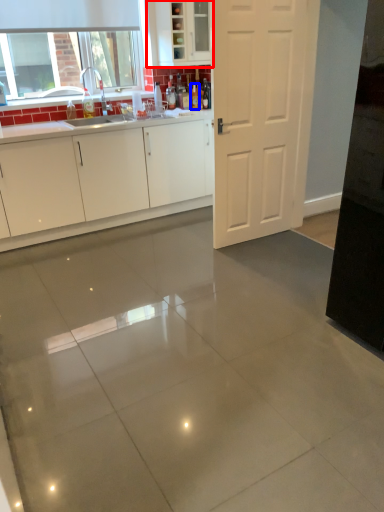
Question: Which object appears farthest to the camera in this image, cabinetry (highlighted by a red box) or bottle (highlighted by a blue box)?

Choices:
 (A) cabinetry
 (B) bottle

Answer: (B)